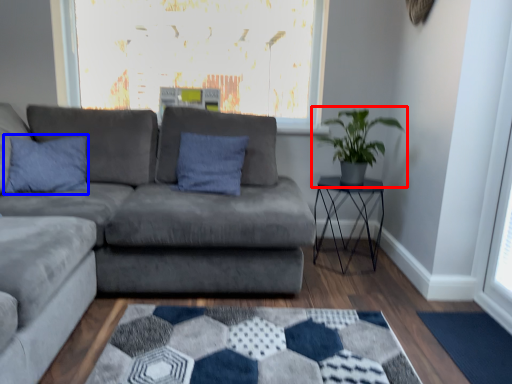
Question: Which object appears farthest to the camera in this image, houseplant (highlighted by a red box) or pillow (highlighted by a blue box)?

Choices:
 (A) houseplant
 (B) pillow

Answer: (A)